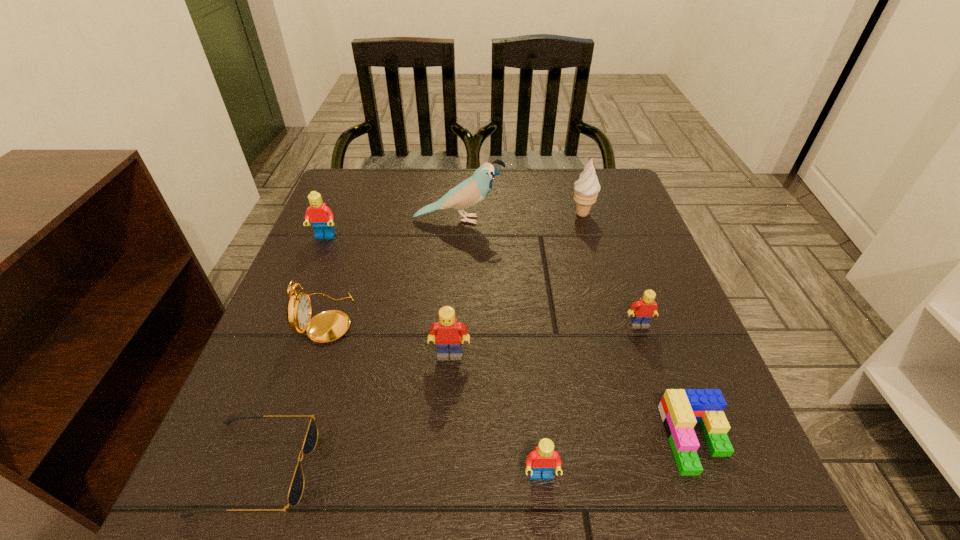
Identify the location of the fourth object from right to left. (543, 459).

Locate an element on the screen. The width and height of the screenshot is (960, 540). the shortest Lego is located at coordinates (680, 409).

Where is `sunglasses`? This screenshot has height=540, width=960. sunglasses is located at coordinates (296, 489).

Find the location of a particular element. blank area located at the face of the blue bird is located at coordinates (543, 220).

Find the location of a particular element. Image resolution: width=960 pixels, height=540 pixels. blank space located on the front-facing side of the icecream is located at coordinates (594, 255).

The image size is (960, 540). Identify the location of vacant space located 0.190m on the face of the seventh nearest object. (x=299, y=301).

Identify the location of vacant area situated on the front-facing side of the third nearest Lego. (445, 429).

The image size is (960, 540). I want to click on vacant space located on the face of the pocket watch, so click(466, 318).

I want to click on blank space located on the front-facing side of the second farthest Lego, so click(x=651, y=359).

At what (x,y) coordinates should I click in order to perform the action: click on vacant area situated on the left of the shortest Lego. Please return your answer as a coordinate pair (x, y). Looking at the image, I should click on point(427,439).